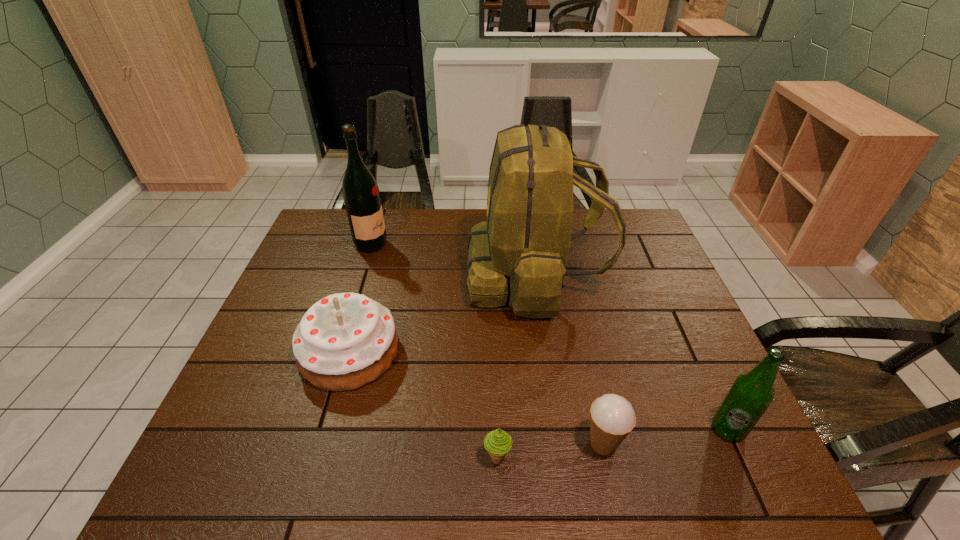
Where is `free spot between the liquor and the left icecream`? free spot between the liquor and the left icecream is located at coordinates (434, 351).

Image resolution: width=960 pixels, height=540 pixels. In order to click on free point between the backpack and the liquor in this screenshot , I will do `click(453, 260)`.

Where is `unoccupied area between the taller icecream and the backpack`? The height and width of the screenshot is (540, 960). unoccupied area between the taller icecream and the backpack is located at coordinates (569, 360).

Find the location of a particular element. The width and height of the screenshot is (960, 540). free space between the rightmost object and the liquor is located at coordinates (549, 337).

Image resolution: width=960 pixels, height=540 pixels. What are the coordinates of `unoccupied area between the right icecream and the cake` in the screenshot? It's located at (476, 398).

At what (x,y) coordinates should I click in order to perform the action: click on object that is the fourth closest to the liquor. Please return your answer as a coordinate pair (x, y). This screenshot has width=960, height=540. Looking at the image, I should click on (612, 417).

You are a GUI agent. You are given a task and a screenshot of the screen. Output one action in this format:
    pyautogui.click(x=<x>, y=<y>)
    Task: Click on the fourth closest object relative to the shortest object
    The image size is (960, 540).
    Given the screenshot: What is the action you would take?
    pyautogui.click(x=751, y=394)

Where is `free region that satisfies the following two spatial constraints: 1. on the front-facing side of the liquor; 2. on the left side of the cake`? free region that satisfies the following two spatial constraints: 1. on the front-facing side of the liquor; 2. on the left side of the cake is located at coordinates (338, 352).